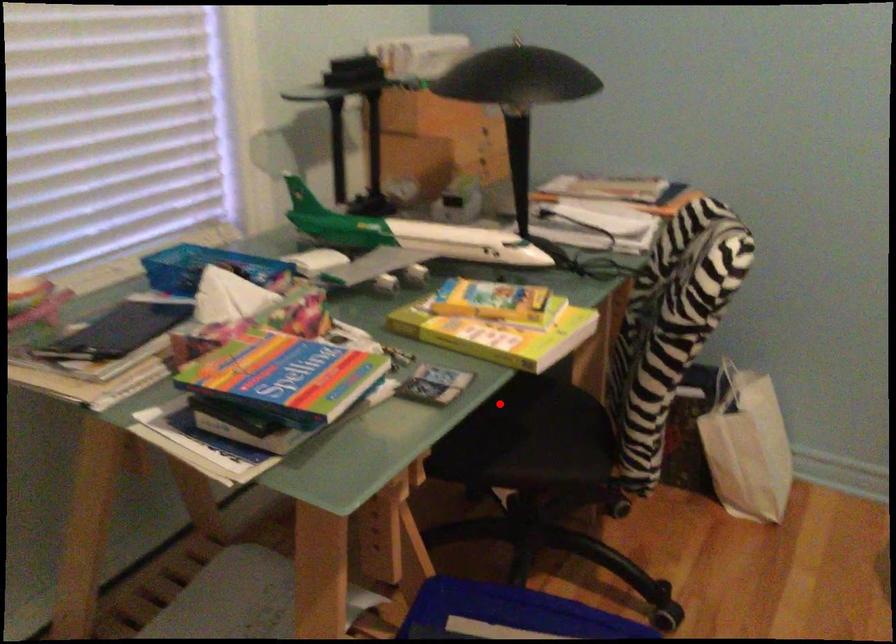
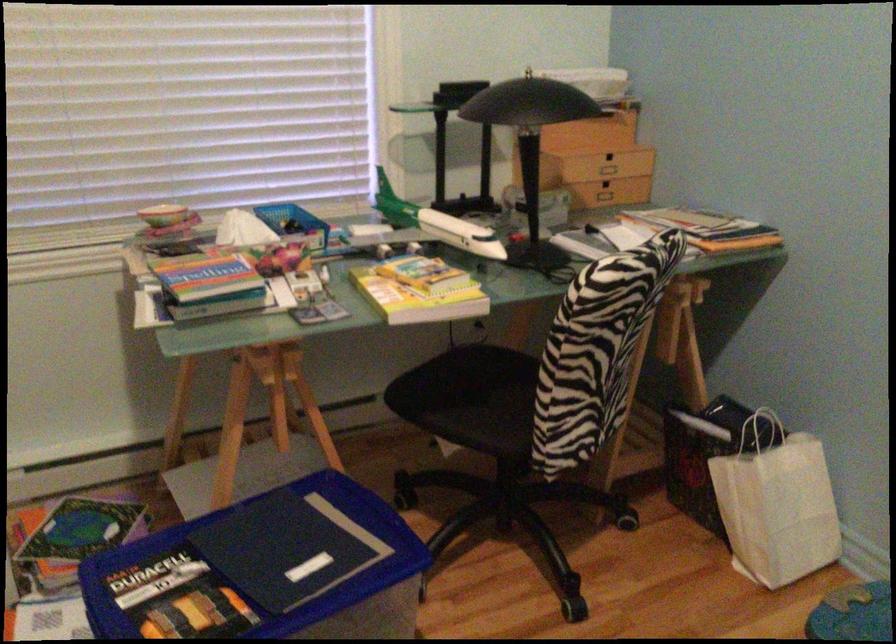
Question: I am providing you with two images of the same scene from different viewpoints. A red point is marked on the first image. Is the red point's position out of view in image 2?

Choices:
 (A) Yes
 (B) No

Answer: (B)